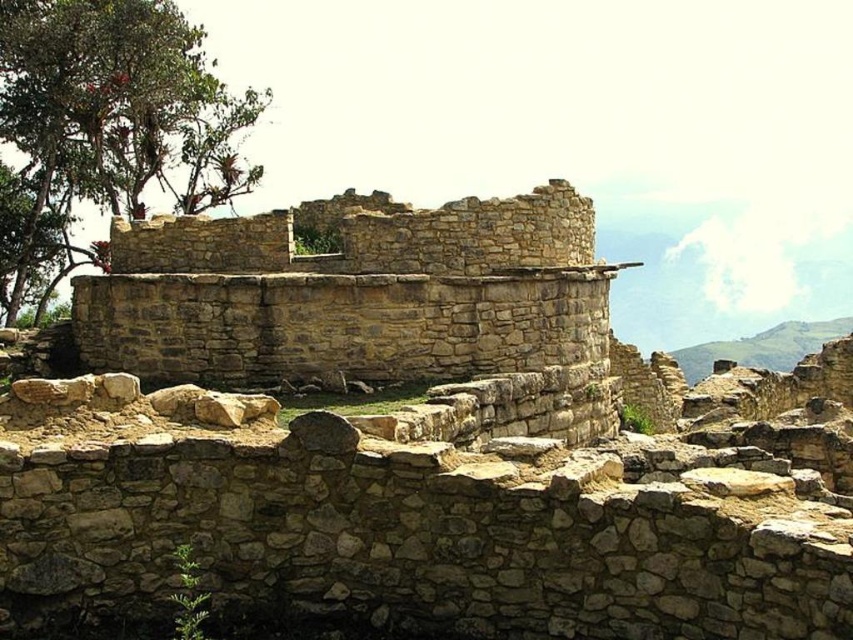
Does natural stone ruins at center have a smaller size compared to green leafy tree at upper left?

Correct, natural stone ruins at center occupies less space than green leafy tree at upper left.

Is point (418, 307) behind point (213, 138)?

No, (418, 307) is closer to viewer.

Image resolution: width=853 pixels, height=640 pixels. What are the coordinates of `natural stone ruins at center` in the screenshot? It's located at (413, 440).